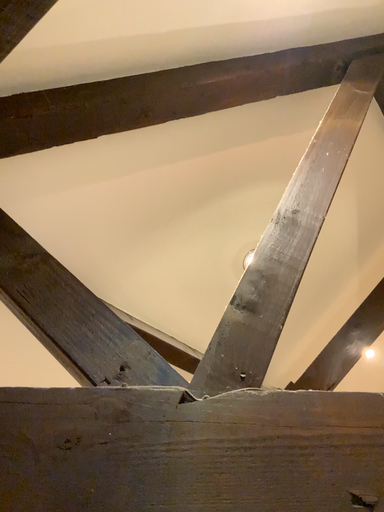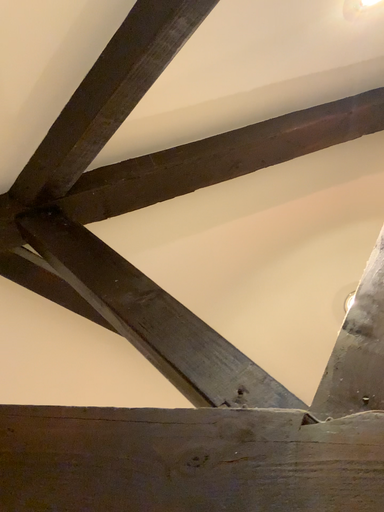
Question: Which way did the camera rotate in the video?

Choices:
 (A) rotated downward
 (B) rotated upward

Answer: (B)